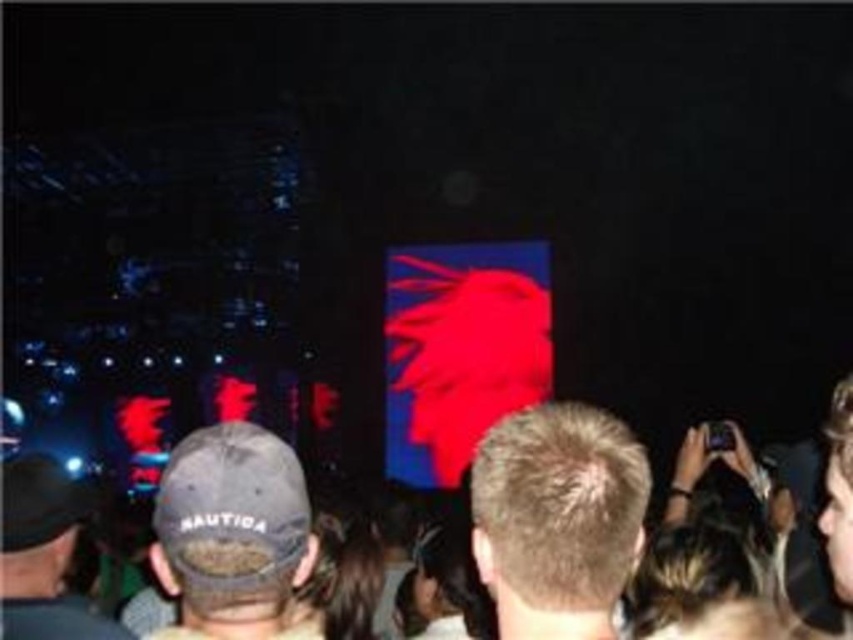
You are at a concert and want to buy a hat similar to the ones you see in the image. Which of the two hats, the camo fabric baseball cap at lower left or the black matte baseball cap at left, is smaller in size?

The camo fabric baseball cap at lower left has a smaller size compared to the black matte baseball cap at left.

You are standing at the front of the stage and want to move to the back of the concert venue. Which point, point (613, 552) or point (44, 500), would you encounter first while walking backwards?

Point (613, 552) is in front of point (44, 500), so you would encounter point (613, 552) first while walking backwards from the front of the stage.